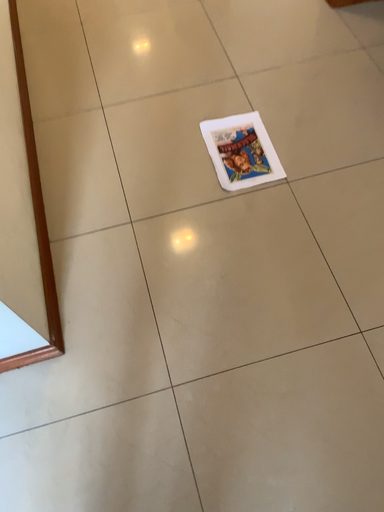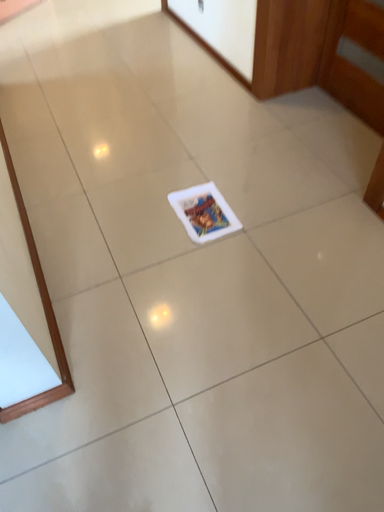
Question: How did the camera likely rotate when shooting the video?

Choices:
 (A) rotated upward
 (B) rotated downward

Answer: (A)